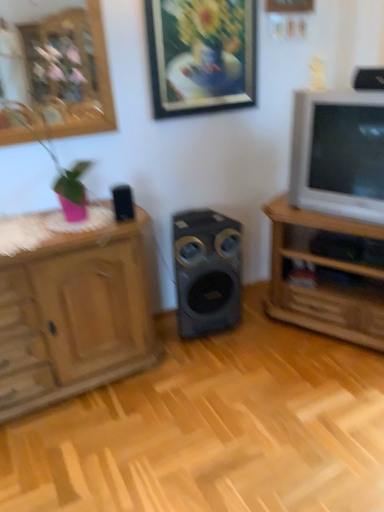
Where is `spots to the right of wooden cabinet at left`? spots to the right of wooden cabinet at left is located at coordinates click(204, 384).